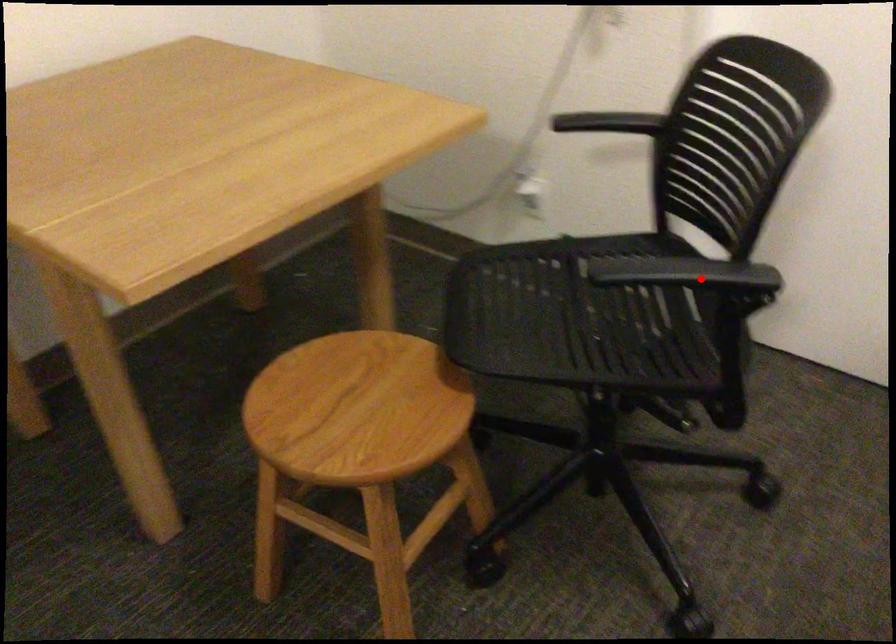
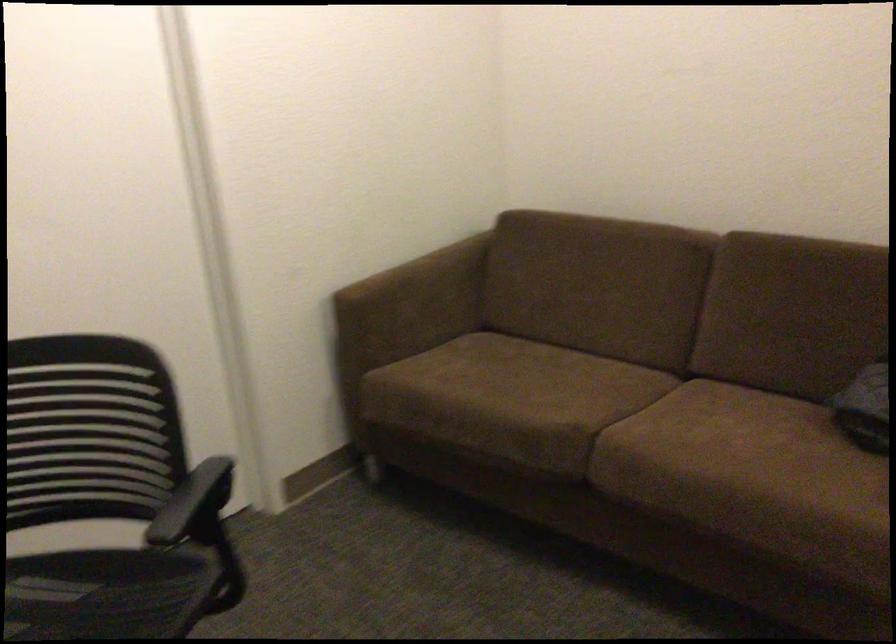
Question: I am providing you with two images of the same scene from different viewpoints. Given a red point in image1, look at the same physical point in image2. Is it:

Choices:
 (A) Closer to the viewpoint
 (B) Farther from the viewpoint

Answer: (B)